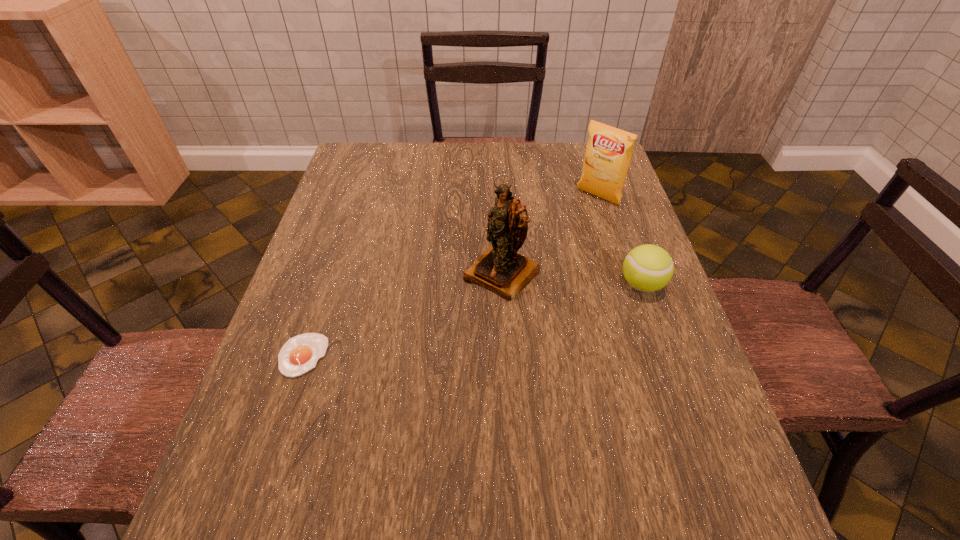
Locate an element on the screen. Image resolution: width=960 pixels, height=540 pixels. the nearest object is located at coordinates (299, 354).

Locate an element on the screen. The width and height of the screenshot is (960, 540). the shortest object is located at coordinates (299, 354).

Where is `tennis ball`? tennis ball is located at coordinates (647, 268).

In order to click on crisp (potato chip) in this screenshot , I will do `click(609, 150)`.

At what (x,y) coordinates should I click in order to perform the action: click on the second tallest object. Please return your answer as a coordinate pair (x, y). This screenshot has height=540, width=960. Looking at the image, I should click on point(609,150).

Where is `the second object from left to right`? This screenshot has height=540, width=960. the second object from left to right is located at coordinates (500, 269).

This screenshot has width=960, height=540. In order to click on figurine in this screenshot , I will do `click(500, 269)`.

Locate an element on the screen. This screenshot has height=540, width=960. free location located on the back of the leftmost object is located at coordinates (342, 238).

Identify the location of vacant space located 0.100m on the left of the tennis ball. (577, 285).

Find the location of a particular element. free point located on the front of the crisp (potato chip) with the logo is located at coordinates (546, 245).